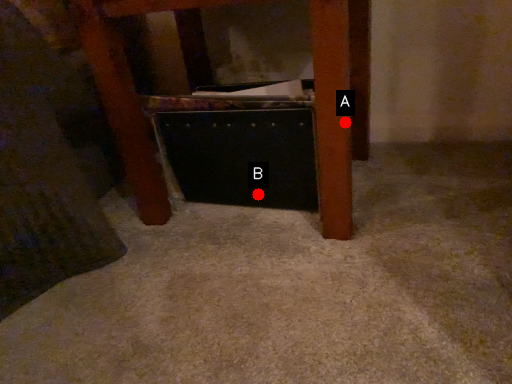
Question: Two points are circled on the image, labeled by A and B beside each circle. Among these points, which one is nearest to the camera?

Choices:
 (A) A is closer
 (B) B is closer

Answer: (A)